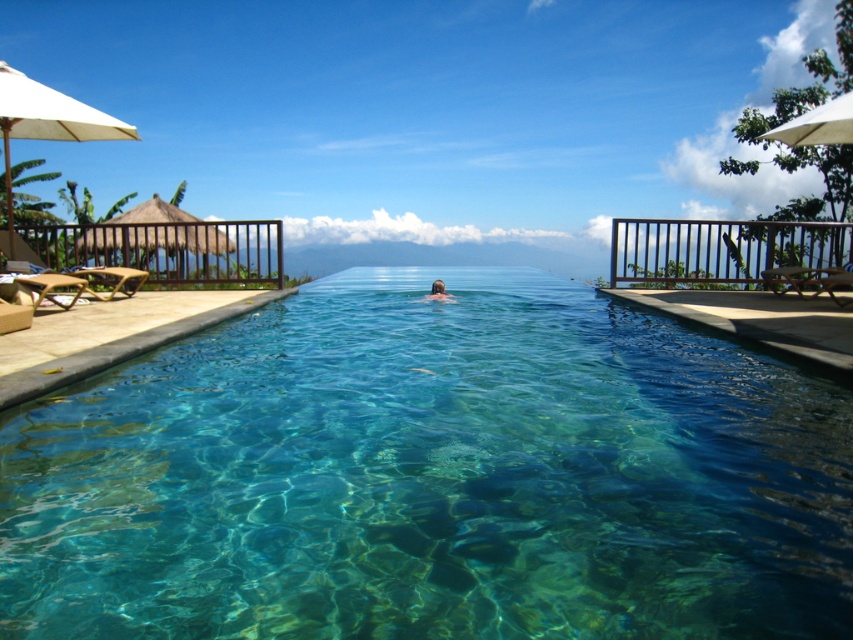
Looking at this image, you are a lifeguard standing at the edge of the infinity pool. You notice a white fabric umbrella at left and a brown hair at center in the scene. Which object is wider when viewed from above?

The white fabric umbrella at left is wider than brown hair at center according to the description.

You are planning to place a new rectangular sunbed that is 2 meters long on the pool deck. The sunbed must be placed parallel to the clear glass pool at center. Can you determine if the white fabric umbrella at left will interfere with the placement of the sunbed?

The clear glass pool at center might be wider than white fabric umbrella at left, so it depends on the exact dimensions. If the pool is indeed wider, there might be enough space to place the sunbed parallel to it without interference from the umbrella. However, without precise measurements, it is uncertain.